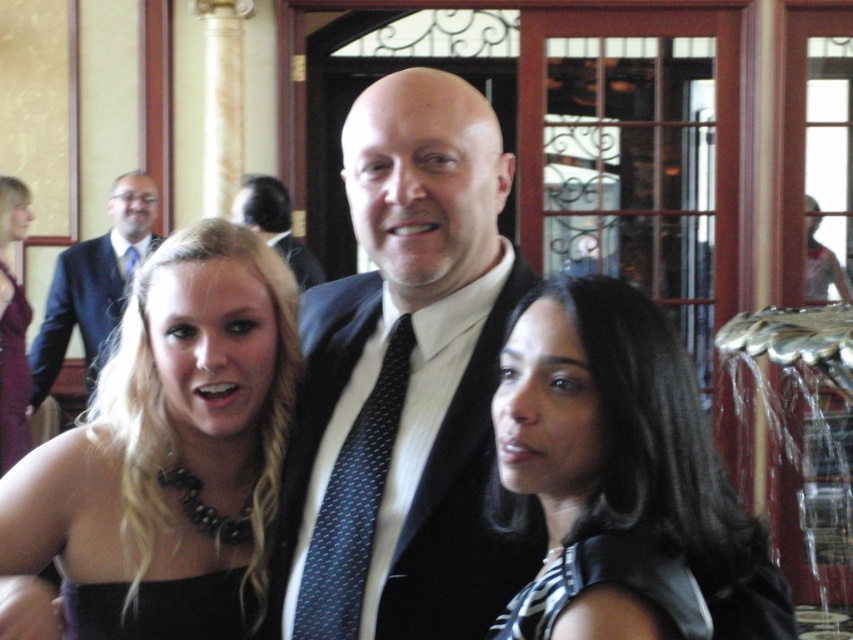
Question: Which point appears closest to the camera in this image?

Choices:
 (A) (163, 593)
 (B) (316, 282)
 (C) (291, 256)
 (D) (698, 397)

Answer: (D)

Question: Which point is farther from the camera taking this photo?

Choices:
 (A) (294, 268)
 (B) (107, 448)
 (C) (236, 218)

Answer: (A)

Question: Is dark blue textured suit at center further to camera compared to maroon satin dress at left?

Choices:
 (A) no
 (B) yes

Answer: (A)

Question: Does black silk tie at center have a greater width compared to dark suit at center?

Choices:
 (A) no
 (B) yes

Answer: (A)

Question: Where is matte black suit at upper left located in relation to dark blue textured tie at center in the image?

Choices:
 (A) above
 (B) below

Answer: (B)

Question: Based on their relative distances, which object is nearer to the matte black dress at center?

Choices:
 (A) black satin dress at lower left
 (B) maroon satin dress at left
 (C) dark blue textured tie at center

Answer: (A)